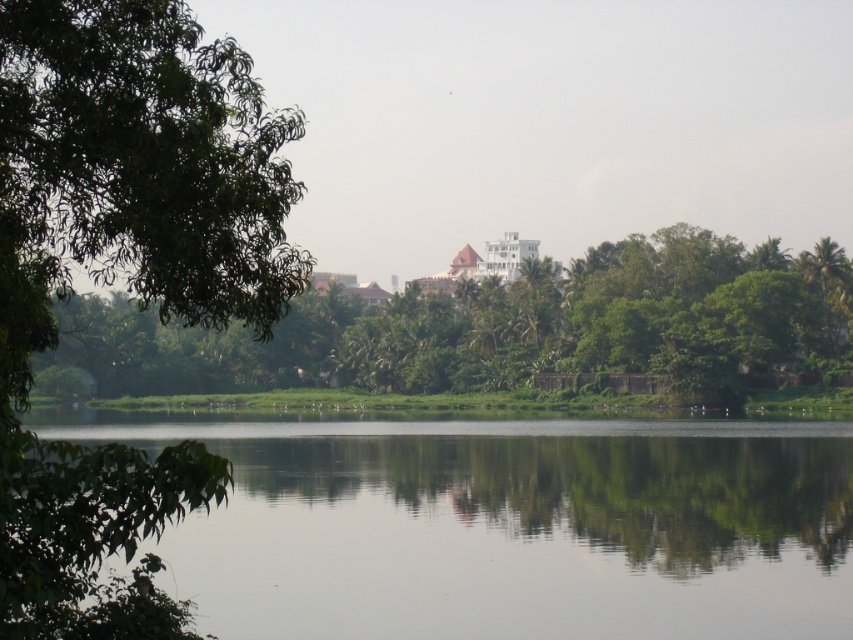
Does smooth reflective water at center have a greater width compared to green leafy tree at center?

Incorrect, smooth reflective water at center's width does not surpass green leafy tree at center's.

Is point (762, 420) positioned in front of point (91, 344)?

Yes, it is in front of point (91, 344).

Where is `smooth reflective water at center`? smooth reflective water at center is located at coordinates [x=509, y=525].

Who is taller, green leafy tree at left or white glossy palace at center?

white glossy palace at center

Who is shorter, green leafy tree at left or white glossy palace at center?

green leafy tree at left

Between point (155, 260) and point (490, 257), which one is positioned in front?

Positioned in front is point (155, 260).

At what (x,y) coordinates should I click in order to perform the action: click on green leafy tree at left. Please return your answer as a coordinate pair (x, y). Image resolution: width=853 pixels, height=640 pixels. Looking at the image, I should click on pyautogui.click(x=126, y=273).

Measure the distance between smooth reflective water at center and green leafy tree at left.

smooth reflective water at center is 141.90 feet from green leafy tree at left.

Describe the element at coordinates (509, 525) in the screenshot. The width and height of the screenshot is (853, 640). I see `smooth reflective water at center` at that location.

The height and width of the screenshot is (640, 853). I want to click on smooth reflective water at center, so click(509, 525).